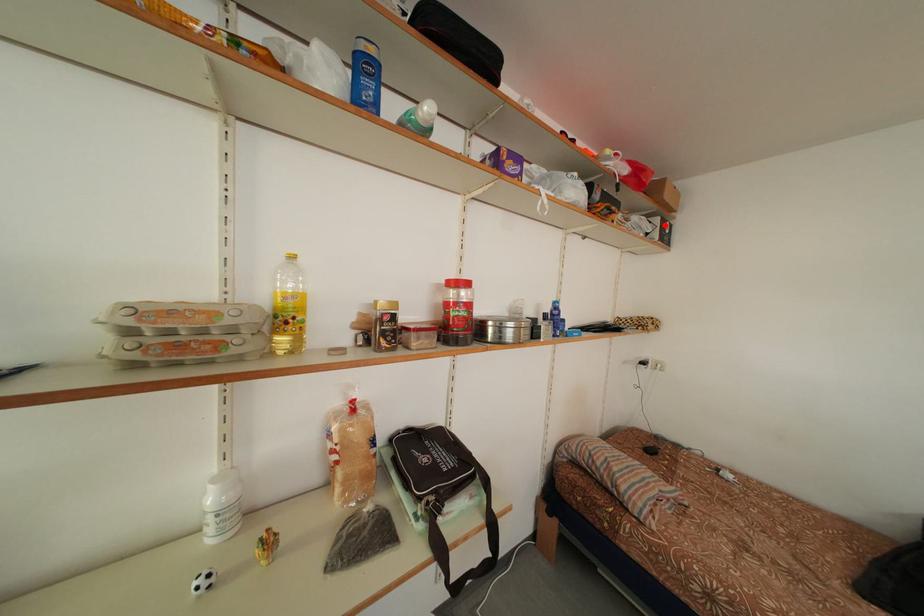
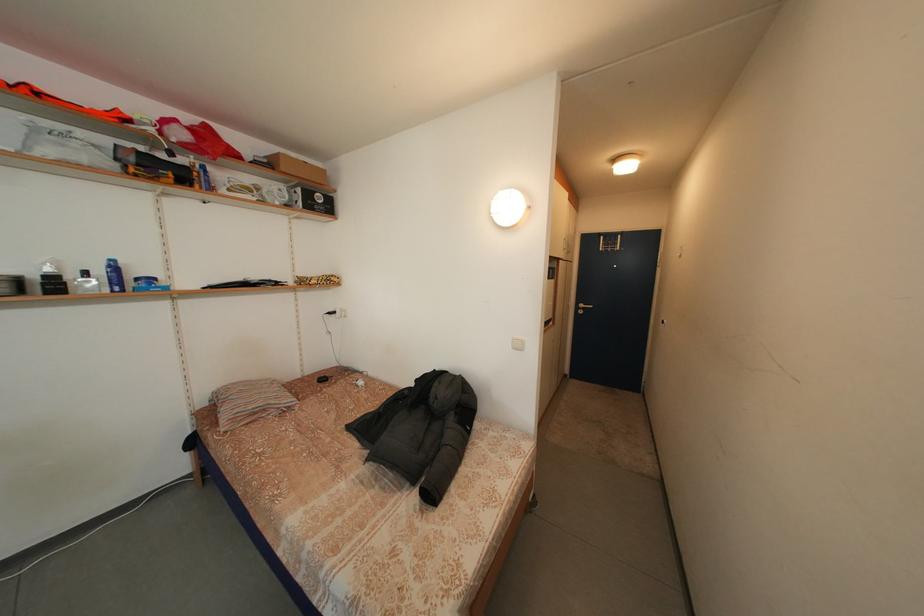
The point at the highlighted location is marked in the first image. Where is the corresponding point in the second image?

(307, 196)